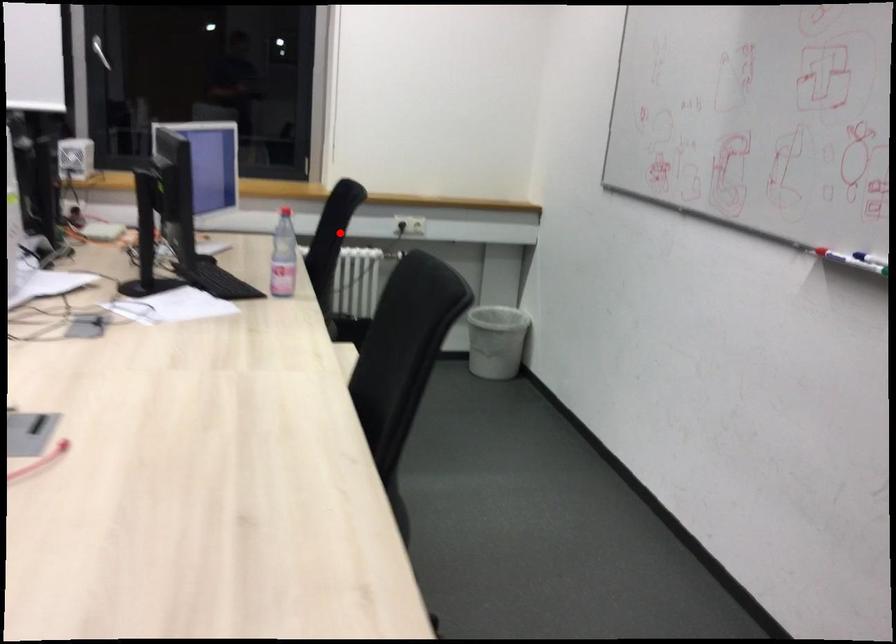
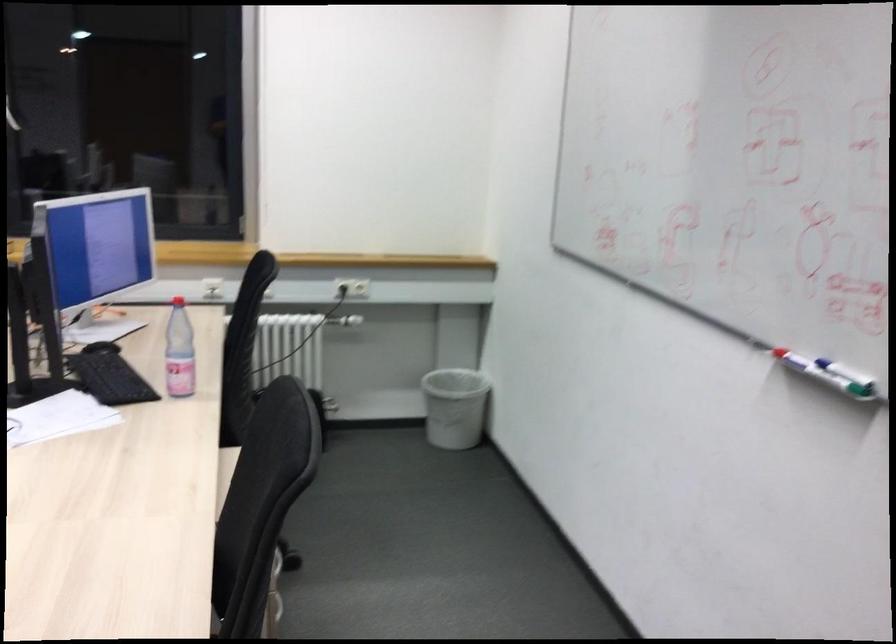
Question: A red point is marked in image1. In image2, is the corresponding 3D point closer to the camera or farther? Reply with the corresponding letter.

Choices:
 (A) The corresponding 3D point is closer.
 (B) The corresponding 3D point is farther.

Answer: (A)